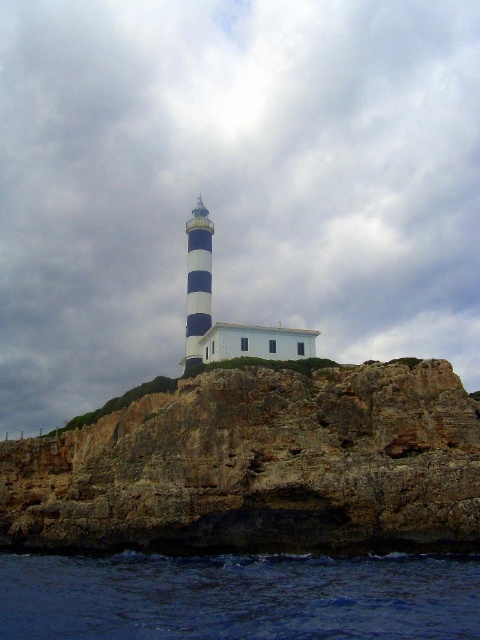
Consider the image. You are standing at the base of the lighthouse and looking towards the cliff. There are two points marked on the cliff face. The first point is at coordinates point (178, 484) and the second is at point (197, 292). Which of these two points is closer to you?

Point (178, 484) is in front of point (197, 292), so it is closer to you.

You are a seagull flying near the rugged stone cliff at center and the dark blue water at lower left. Which object is higher in elevation?

The rugged stone cliff at center is located above the dark blue water at lower left, so it is higher in elevation.